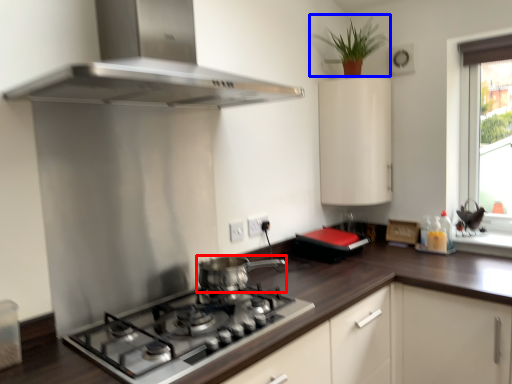
Question: Among these objects, which one is farthest to the camera, kitchen appliance (highlighted by a red box) or plant (highlighted by a blue box)?

Choices:
 (A) kitchen appliance
 (B) plant

Answer: (B)